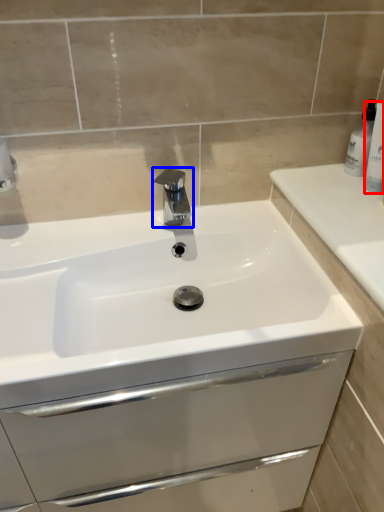
Question: Which of the following is the farthest to the observer, toiletry (highlighted by a red box) or tap (highlighted by a blue box)?

Choices:
 (A) toiletry
 (B) tap

Answer: (B)